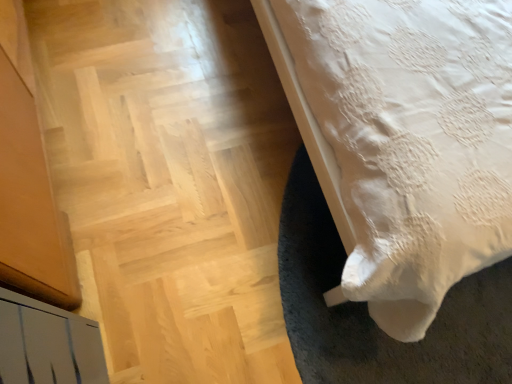
Find the location of a particular element. Image resolution: width=512 pixels, height=384 pixels. white lace bed at lower right is located at coordinates (404, 140).

Image resolution: width=512 pixels, height=384 pixels. What do you see at coordinates (404, 140) in the screenshot?
I see `white lace bed at lower right` at bounding box center [404, 140].

What is the approximate width of wooden parquet floor at lower left?

The width of wooden parquet floor at lower left is 1.40 meters.

Image resolution: width=512 pixels, height=384 pixels. What do you see at coordinates (170, 181) in the screenshot? I see `wooden parquet floor at lower left` at bounding box center [170, 181].

You are a GUI agent. You are given a task and a screenshot of the screen. Output one action in this format:
    pyautogui.click(x=<x>, y=<y>)
    Task: Click on the wooden parquet floor at lower left
    
    Given the screenshot: What is the action you would take?
    pyautogui.click(x=170, y=181)

The width and height of the screenshot is (512, 384). Find the location of `white lace bed at lower right`. white lace bed at lower right is located at coordinates (404, 140).

Between white lace bed at lower right and wooden parquet floor at lower left, which one appears on the left side from the viewer's perspective?

wooden parquet floor at lower left.

Is white lace bed at lower right in front of wooden parquet floor at lower left?

Yes.

Does point (272, 32) lie in front of point (115, 181)?

Yes, point (272, 32) is in front of point (115, 181).

From the image's perspective, is white lace bed at lower right above or below wooden parquet floor at lower left?

From the image's perspective, white lace bed at lower right appears above wooden parquet floor at lower left.

From a real-world perspective, is white lace bed at lower right over wooden parquet floor at lower left?

Yes, from a real-world perspective, white lace bed at lower right is over wooden parquet floor at lower left

Can you confirm if white lace bed at lower right is thinner than wooden parquet floor at lower left?

Indeed, white lace bed at lower right has a lesser width compared to wooden parquet floor at lower left.

Is white lace bed at lower right taller or shorter than wooden parquet floor at lower left?

In the image, white lace bed at lower right appears to be taller than wooden parquet floor at lower left.

Can you confirm if white lace bed at lower right is bigger than wooden parquet floor at lower left?

Yes.

Would you say wooden parquet floor at lower left is part of white lace bed at lower right's contents?

No, white lace bed at lower right does not contain wooden parquet floor at lower left.

Is white lace bed at lower right positioned far away from wooden parquet floor at lower left?

No, there isn't a large distance between white lace bed at lower right and wooden parquet floor at lower left.

Is white lace bed at lower right oriented towards wooden parquet floor at lower left?

No, white lace bed at lower right is not oriented towards wooden parquet floor at lower left.

At what (x,y) coordinates should I click in order to perform the action: click on stairwell located on the left of white lace bed at lower right. Please return your answer as a coordinate pair (x, y). Image resolution: width=512 pixels, height=384 pixels. Looking at the image, I should click on (170, 181).

Consider the image. Is wooden parquet floor at lower left to the left or to the right of white lace bed at lower right in the image?

wooden parquet floor at lower left is positioned on white lace bed at lower right's left side.

Considering their positions, is wooden parquet floor at lower left located in front of or behind white lace bed at lower right?

wooden parquet floor at lower left is behind white lace bed at lower right.

Is point (232, 261) in front of point (403, 61)?

No, it is not.

From the image's perspective, would you say wooden parquet floor at lower left is positioned over white lace bed at lower right?

Actually, wooden parquet floor at lower left appears below white lace bed at lower right in the image.

From a real-world perspective, is wooden parquet floor at lower left above or below white lace bed at lower right?

In terms of real-world spatial position, wooden parquet floor at lower left is below white lace bed at lower right.

Consider the image. Can you confirm if wooden parquet floor at lower left is wider than white lace bed at lower right?

Yes.

Who is taller, wooden parquet floor at lower left or white lace bed at lower right?

Standing taller between the two is white lace bed at lower right.

Considering the sizes of objects wooden parquet floor at lower left and white lace bed at lower right in the image provided, who is bigger, wooden parquet floor at lower left or white lace bed at lower right?

white lace bed at lower right is bigger.

Do you think wooden parquet floor at lower left is within white lace bed at lower right, or outside of it?

wooden parquet floor at lower left is not enclosed by white lace bed at lower right.

Is wooden parquet floor at lower left far away from white lace bed at lower right?

No, wooden parquet floor at lower left is not far away from white lace bed at lower right.

Is wooden parquet floor at lower left facing away from white lace bed at lower right?

No, white lace bed at lower right is not at the back of wooden parquet floor at lower left.

How many degrees apart are the facing directions of wooden parquet floor at lower left and white lace bed at lower right?

88.8 degrees.

Find the location of a particular element. Image resolution: width=512 pixels, height=384 pixels. bed above the wooden parquet floor at lower left (from a real-world perspective) is located at coordinates (404, 140).

The width and height of the screenshot is (512, 384). In the image, there is a white lace bed at lower right. Identify the location of stairwell below it (from the image's perspective). (170, 181).

Find the location of a particular element. The width and height of the screenshot is (512, 384). stairwell on the left of white lace bed at lower right is located at coordinates (170, 181).